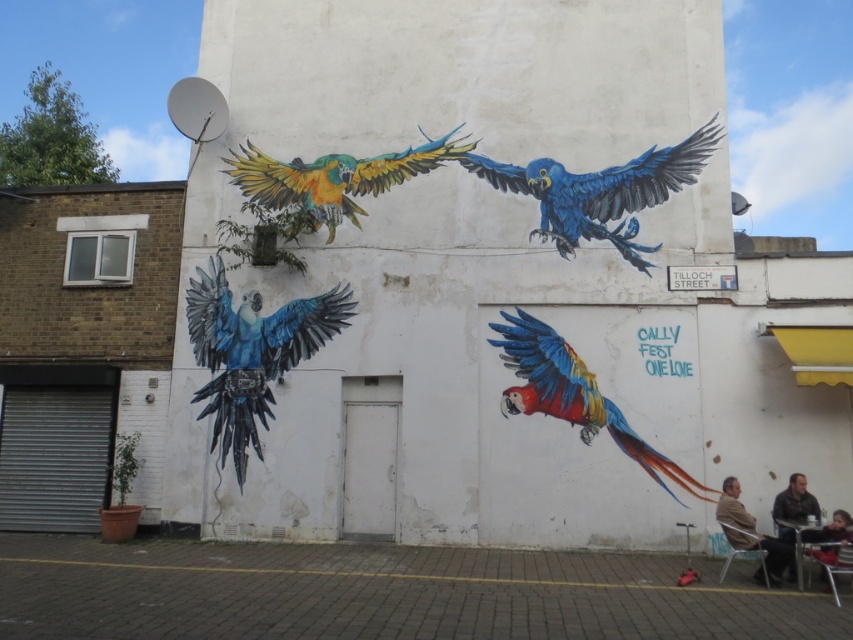
Question: Does shiny metallic parrot at upper center have a greater width compared to red sweater at lower right?

Choices:
 (A) yes
 (B) no

Answer: (A)

Question: Does blue glossy parrot at upper center have a greater width compared to leather jacket at lower right?

Choices:
 (A) yes
 (B) no

Answer: (A)

Question: Can you confirm if shiny metallic parrot at upper center is thinner than leather jacket at lower right?

Choices:
 (A) no
 (B) yes

Answer: (A)

Question: Which object is the closest to the brown leather jacket at lower right?

Choices:
 (A) shiny multicolored parrot at center
 (B) blue glossy parrot at center

Answer: (A)

Question: Which of the following is the closest to the observer?

Choices:
 (A) blue glossy parrot at upper center
 (B) shiny metallic parrot at upper center

Answer: (A)

Question: Which of the following is the closest to the observer?

Choices:
 (A) (241, 381)
 (B) (370, 177)
 (C) (811, 531)

Answer: (C)